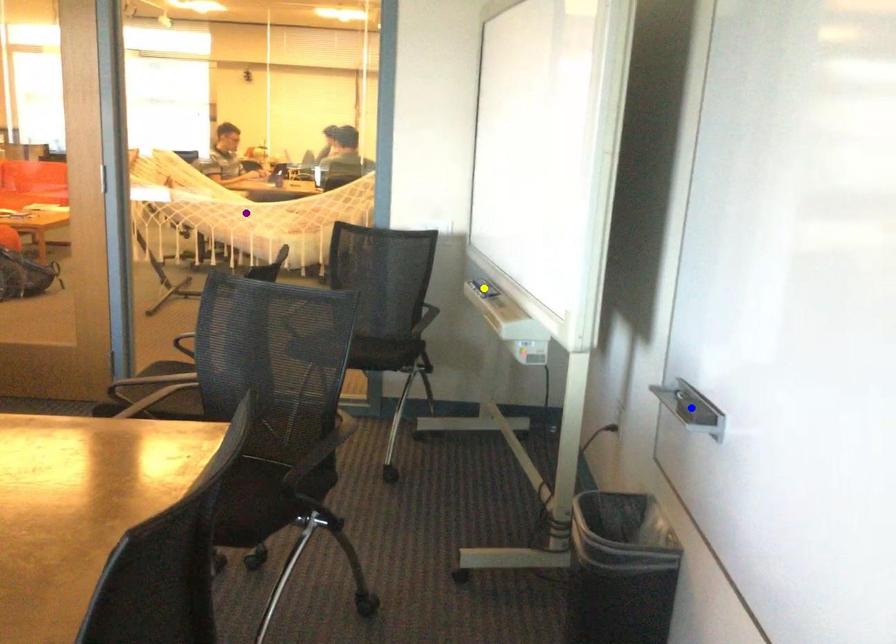
Order these from nearest to farthest:
purple point
blue point
yellow point

1. blue point
2. yellow point
3. purple point